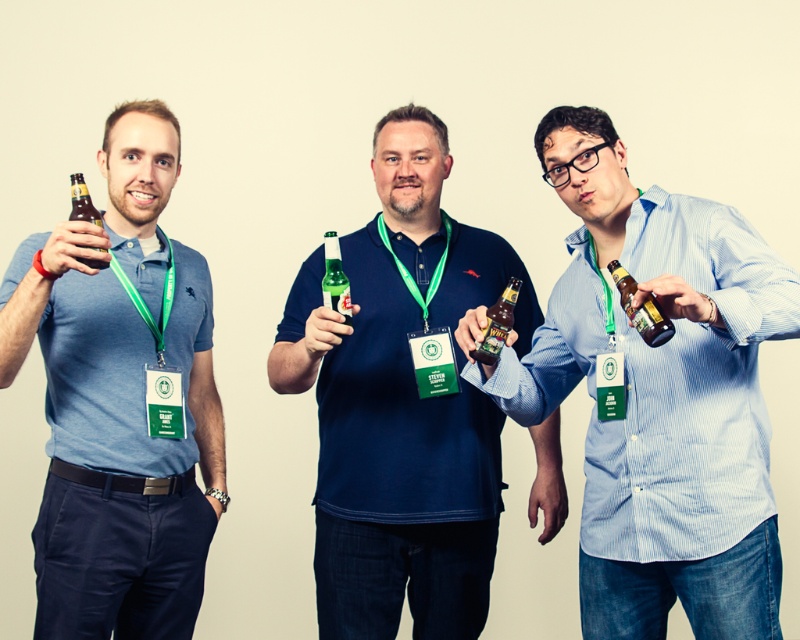
Between point (106, 353) and point (322, 285), which one is positioned behind?

Positioned behind is point (106, 353).

At what (x,y) coordinates should I click in order to perform the action: click on matte blue shirt at left. Please return your answer as a coordinate pair (x, y). Looking at the image, I should click on (120, 401).

Can you confirm if striped cotton shirt at center is shorter than green glass bottle at center?

In fact, striped cotton shirt at center may be taller than green glass bottle at center.

Locate an element on the screen. striped cotton shirt at center is located at coordinates (662, 396).

Does striped cotton shirt at center have a lesser width compared to matte glass beer bottle at center?

Incorrect, striped cotton shirt at center's width is not less than matte glass beer bottle at center's.

Looking at this image, between striped cotton shirt at center and matte glass beer bottle at center, which one has more height?

striped cotton shirt at center is taller.

The height and width of the screenshot is (640, 800). I want to click on striped cotton shirt at center, so click(x=662, y=396).

Locate an element on the screen. The image size is (800, 640). striped cotton shirt at center is located at coordinates (662, 396).